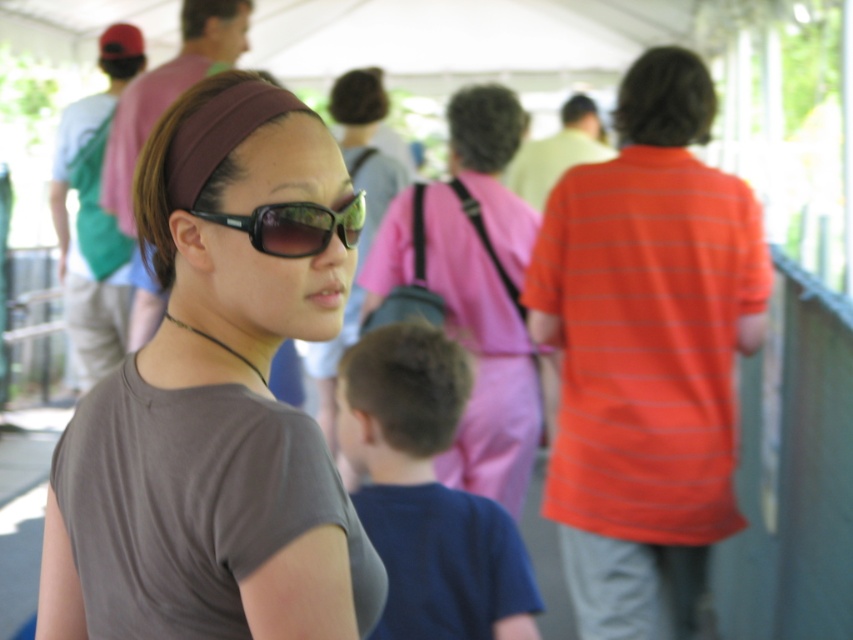
Does point (397, 588) come closer to viewer compared to point (399, 220)?

Yes, it is in front of point (399, 220).

Does point (480, 614) come farther from viewer compared to point (462, 275)?

No, (480, 614) is closer to viewer.

Identify the location of blue cotton shirt at center. (427, 493).

Does matte brown headband at center have a smaller size compared to orange striped shirt at right?

Yes.

Does point (357, 595) come farther from viewer compared to point (613, 321)?

No, (357, 595) is in front of (613, 321).

The height and width of the screenshot is (640, 853). In order to click on matte brown headband at center in this screenshot , I will do `click(213, 420)`.

Who is higher up, pink fabric dress at center or black plastic sunglasses at center?

black plastic sunglasses at center

Is point (486, 460) behind point (270, 253)?

Yes, it is behind point (270, 253).

Who is more distant from viewer, (363, 284) or (260, 216)?

The point (363, 284) is more distant.

You are a GUI agent. You are given a task and a screenshot of the screen. Output one action in this format:
    pyautogui.click(x=<x>, y=<y>)
    Task: Click on the pink fabric dress at center
    The image size is (853, 640).
    Given the screenshot: What is the action you would take?
    pyautogui.click(x=482, y=358)